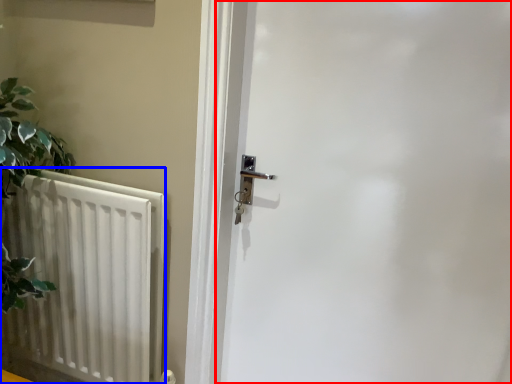
Question: Which point is further to the camera, door (highlighted by a red box) or radiator (highlighted by a blue box)?

Choices:
 (A) door
 (B) radiator

Answer: (B)